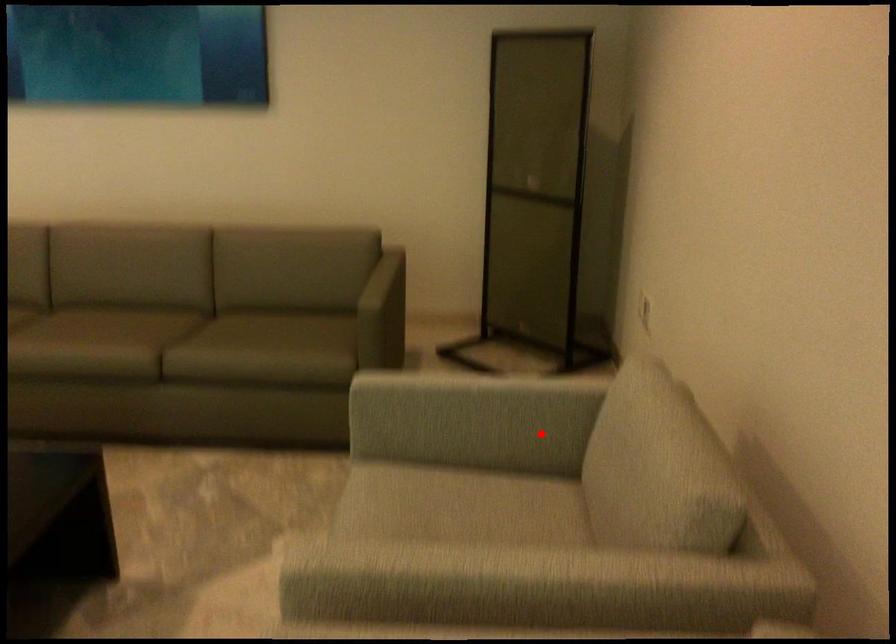
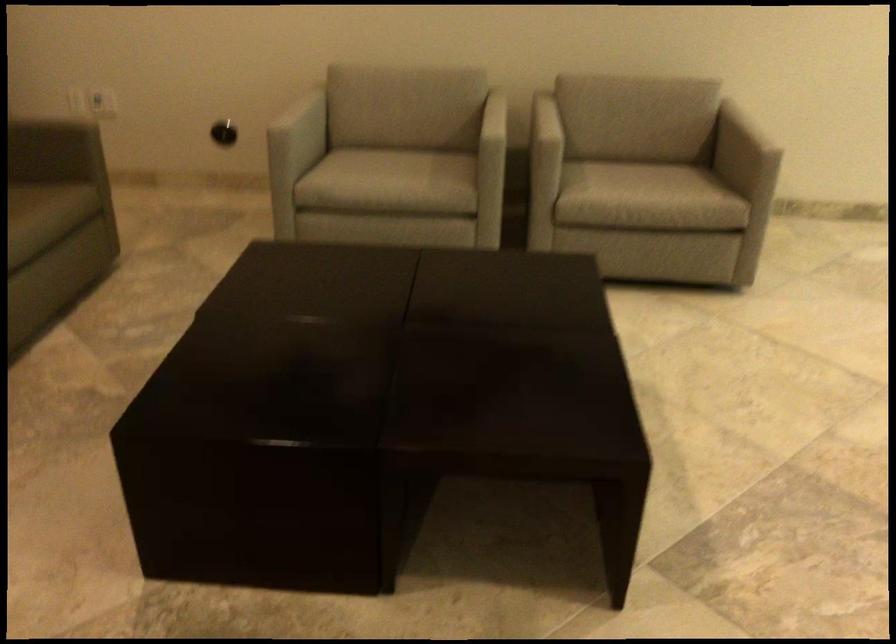
Question: I am providing you with two images of the same scene from different viewpoints. Image1 has a red point marked. In image2, the corresponding 3D location appears at what relative position? Reply with the corresponding letter.

Choices:
 (A) Closer
 (B) Farther

Answer: (B)